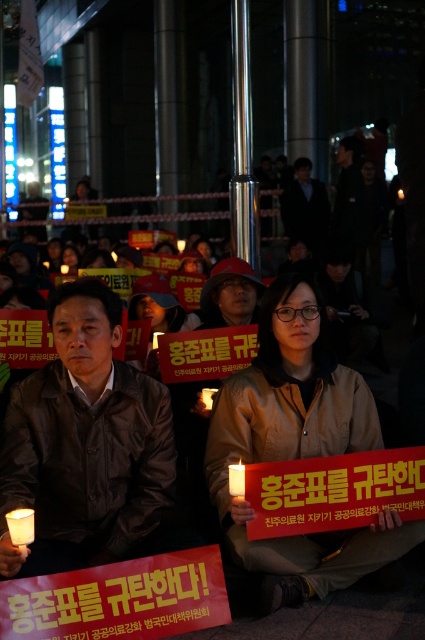
Which is below, brown leather jacket at center or white wax candle at center?

white wax candle at center

Where is `brown leather jacket at center`? The width and height of the screenshot is (425, 640). brown leather jacket at center is located at coordinates (85, 444).

Can you confirm if brown leather jacket at center is positioned to the right of white wax candle at lower left?

Correct, you'll find brown leather jacket at center to the right of white wax candle at lower left.

This screenshot has width=425, height=640. What do you see at coordinates (85, 444) in the screenshot?
I see `brown leather jacket at center` at bounding box center [85, 444].

Who is more distant from viewer, (11, 426) or (28, 516)?

The point (11, 426) is behind.

What are the coordinates of `brown leather jacket at center` in the screenshot? It's located at (85, 444).

Who is shorter, white wax candle at lower left or white wax candle at center?

white wax candle at lower left

Does white wax candle at lower left have a lesser width compared to white wax candle at center?

No, white wax candle at lower left is not thinner than white wax candle at center.

Locate an element on the screen. The width and height of the screenshot is (425, 640). white wax candle at lower left is located at coordinates (20, 525).